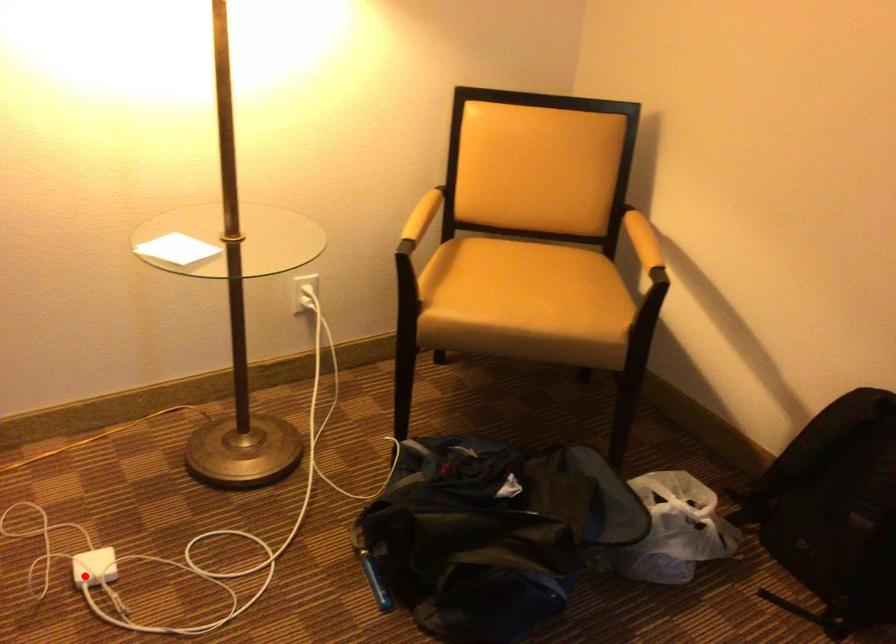
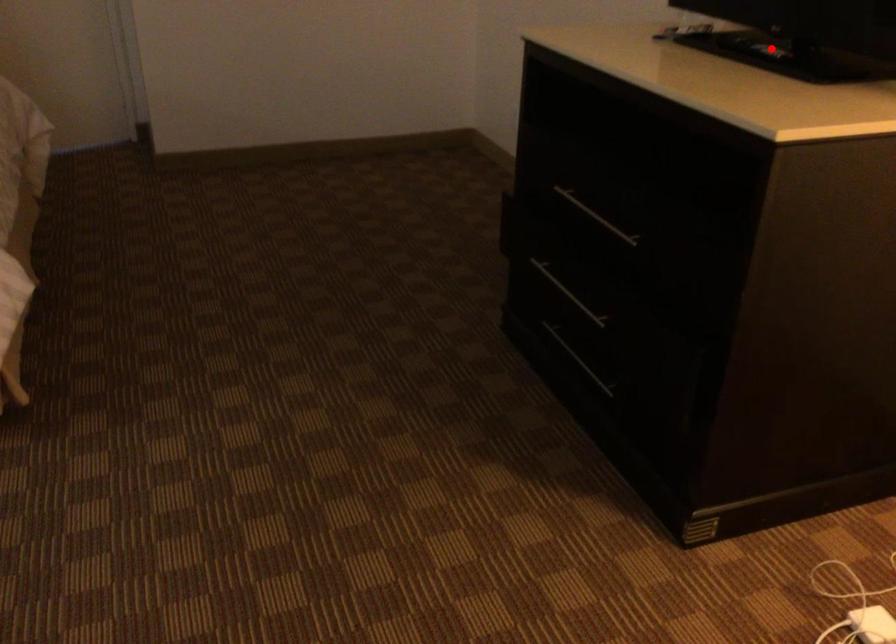
Consider the image. I am providing you with two images of the same scene from different viewpoints. A red point is marked on the first image and another point is marked on the second image. Is the marked point in image1 the same physical position as the marked point in image2?

No